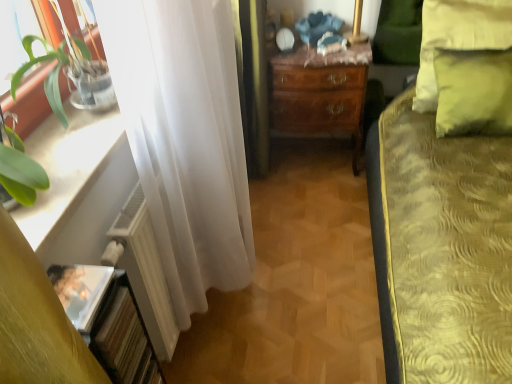
Question: Considering the relative sizes of white glossy window sill at left and white matte radiator at left in the image provided, is white glossy window sill at left bigger than white matte radiator at left?

Choices:
 (A) no
 (B) yes

Answer: (A)

Question: From the image's perspective, is white glossy window sill at left located above white matte radiator at left?

Choices:
 (A) yes
 (B) no

Answer: (A)

Question: Is white glossy window sill at left at the right side of white matte radiator at left?

Choices:
 (A) yes
 (B) no

Answer: (B)

Question: From the image's perspective, does white glossy window sill at left appear lower than white matte radiator at left?

Choices:
 (A) no
 (B) yes

Answer: (A)

Question: Is white glossy window sill at left not inside white matte radiator at left?

Choices:
 (A) yes
 (B) no

Answer: (A)

Question: From the image's perspective, is mahogany wooden desk at center positioned above or below white matte radiator at left?

Choices:
 (A) above
 (B) below

Answer: (A)

Question: Considering the positions of mahogany wooden desk at center and white matte radiator at left in the image, is mahogany wooden desk at center bigger or smaller than white matte radiator at left?

Choices:
 (A) small
 (B) big

Answer: (B)

Question: Is mahogany wooden desk at center wider or thinner than white matte radiator at left?

Choices:
 (A) thin
 (B) wide

Answer: (B)

Question: Relative to white matte radiator at left, is mahogany wooden desk at center in front or behind?

Choices:
 (A) behind
 (B) front

Answer: (A)

Question: Is white sheer curtain at left bigger or smaller than mahogany wooden desk at center?

Choices:
 (A) small
 (B) big

Answer: (B)

Question: Is point (207, 14) closer or farther from the camera than point (323, 97)?

Choices:
 (A) farther
 (B) closer

Answer: (B)

Question: From a real-world perspective, relative to mahogany wooden desk at center, is white sheer curtain at left vertically above or below?

Choices:
 (A) above
 (B) below

Answer: (A)

Question: From the image's perspective, is white sheer curtain at left located above or below mahogany wooden desk at center?

Choices:
 (A) above
 (B) below

Answer: (B)

Question: Based on their positions, is white sheer curtain at left located to the left or right of yellow fabric pillow at upper right?

Choices:
 (A) left
 (B) right

Answer: (A)

Question: Is point (239, 130) positioned closer to the camera than point (448, 34)?

Choices:
 (A) farther
 (B) closer

Answer: (B)